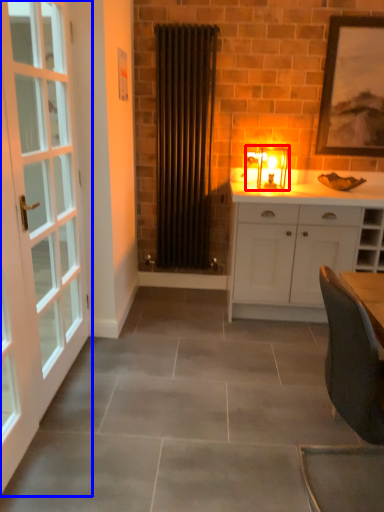
Question: Which point is closer to the camera, light fixture (highlighted by a red box) or door (highlighted by a blue box)?

Choices:
 (A) light fixture
 (B) door

Answer: (B)